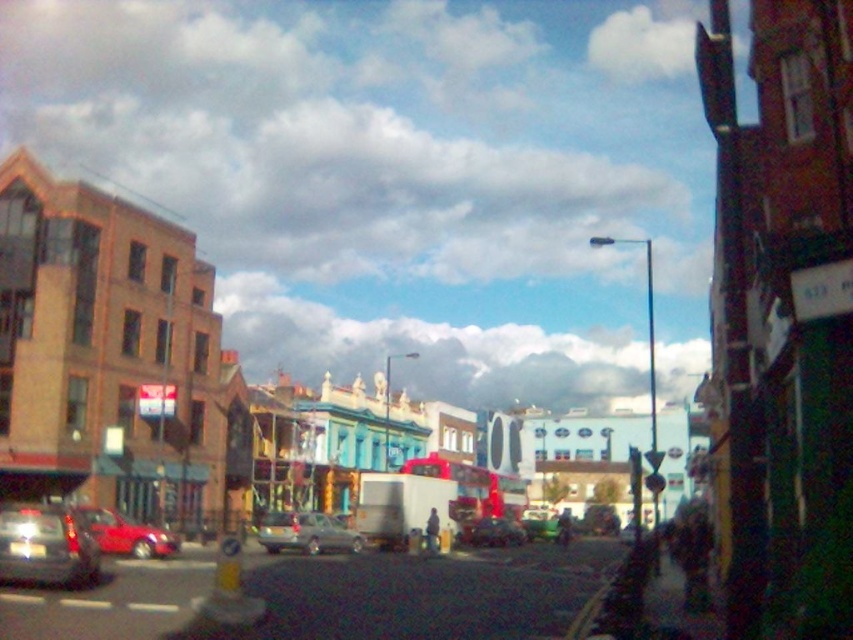
Question: Can you confirm if shiny silver car at center is positioned to the right of metallic green car at center?

Choices:
 (A) yes
 (B) no

Answer: (B)

Question: Which of the following is the closest to the observer?

Choices:
 (A) shiny silver car at center
 (B) metallic silver car at center
 (C) shiny red car at lower left
 (D) shiny silver car at lower left

Answer: (D)

Question: Is shiny silver car at lower left above shiny silver car at center?

Choices:
 (A) no
 (B) yes

Answer: (B)

Question: Does shiny silver car at lower left have a greater width compared to shiny silver car at center?

Choices:
 (A) yes
 (B) no

Answer: (A)

Question: Estimate the real-world distances between objects in this image. Which object is closer to the shiny silver car at lower left?

Choices:
 (A) metallic silver car at center
 (B) shiny red car at lower left
 (C) shiny silver car at center
 (D) metallic green car at center

Answer: (B)

Question: Which point is closer to the camera?

Choices:
 (A) (508, 525)
 (B) (91, 563)

Answer: (B)